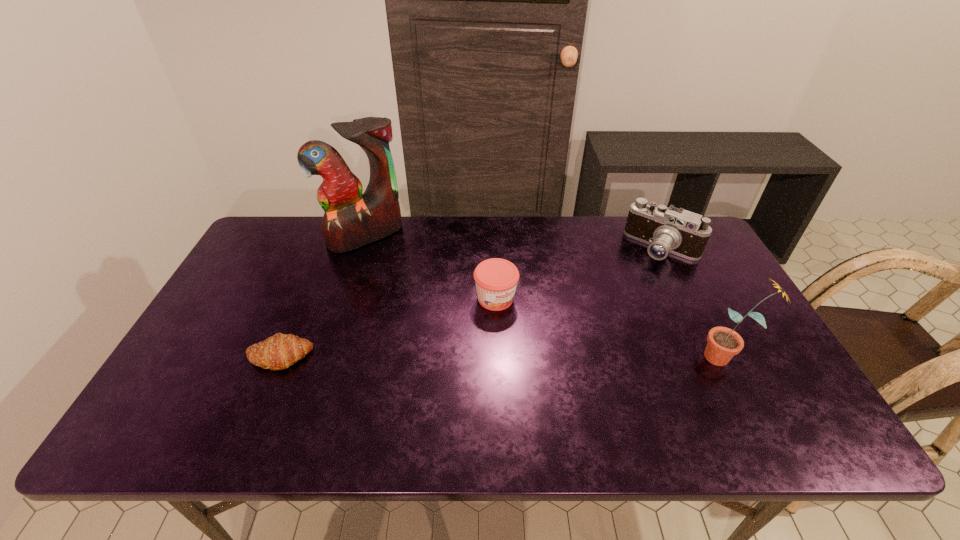
At what (x,y) coordinates should I click in order to perform the action: click on camera at the far edge. Please return your answer as a coordinate pair (x, y). This screenshot has width=960, height=540. Looking at the image, I should click on (666, 230).

Locate an element on the screen. object located at the left edge is located at coordinates (278, 352).

The height and width of the screenshot is (540, 960). What are the coordinates of `sunflower positioned at the right edge` in the screenshot? It's located at click(723, 343).

Find the location of a particular element. camera at the right edge is located at coordinates (666, 230).

Identify the location of object that is positioned at the far right corner. The image size is (960, 540). 666,230.

At what (x,y) coordinates should I click in order to perform the action: click on vacant area at the far edge of the desktop. Please return your answer as a coordinate pair (x, y). Looking at the image, I should click on (449, 258).

I want to click on free space at the near edge, so click(598, 386).

Find the location of a particular element. vacant region at the left edge of the desktop is located at coordinates (279, 269).

In the image, there is a desktop. At what (x,y) coordinates should I click in order to perform the action: click on free space at the right edge. Please return your answer as a coordinate pair (x, y). The image size is (960, 540). Looking at the image, I should click on (681, 282).

Where is `free space at the far left corner of the desktop`? Image resolution: width=960 pixels, height=540 pixels. free space at the far left corner of the desktop is located at coordinates (294, 220).